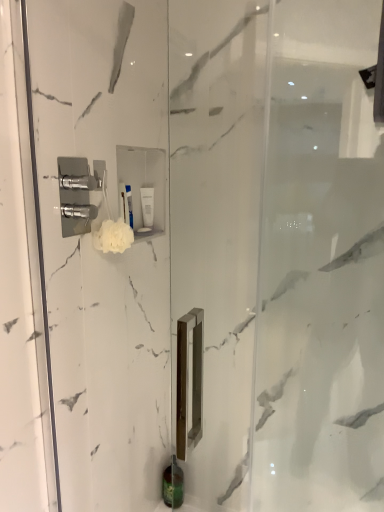
Question: From the image's perspective, does green matte bottle at lower center, the 1th toiletry from the right, appear lower than white fluffy sponge at upper center?

Choices:
 (A) yes
 (B) no

Answer: (A)

Question: Does green matte bottle at lower center, placed as the 1th toiletry when sorted from back to front, have a larger size compared to white fluffy sponge at upper center?

Choices:
 (A) yes
 (B) no

Answer: (A)

Question: From a real-world perspective, is green matte bottle at lower center, placed as the 1th toiletry when sorted from back to front, below white fluffy sponge at upper center?

Choices:
 (A) no
 (B) yes

Answer: (B)

Question: Is there a large distance between green matte bottle at lower center, which appears as the 2th toiletry when viewed from the top, and white fluffy sponge at upper center?

Choices:
 (A) no
 (B) yes

Answer: (B)

Question: Would you say white fluffy sponge at upper center is part of green matte bottle at lower center, the 1th toiletry in the bottom-to-top sequence,'s contents?

Choices:
 (A) yes
 (B) no

Answer: (B)

Question: In the image, is white fluffy sponge at upper center on the left side or the right side of white matte tube at upper center, which is the second toiletry in back-to-front order?

Choices:
 (A) left
 (B) right

Answer: (A)

Question: Which is correct: white fluffy sponge at upper center is inside white matte tube at upper center, placed as the 1th toiletry when sorted from top to bottom, or outside of it?

Choices:
 (A) inside
 (B) outside

Answer: (B)

Question: Is point (124, 248) positioned closer to the camera than point (148, 203)?

Choices:
 (A) farther
 (B) closer

Answer: (B)

Question: From a real-world perspective, is white fluffy sponge at upper center positioned above or below white matte tube at upper center, which is the second toiletry in back-to-front order?

Choices:
 (A) above
 (B) below

Answer: (B)

Question: From a real-world perspective, is white fluffy sponge at upper center positioned above or below green matte bottle at lower center, which is the 2th toiletry in left-to-right order?

Choices:
 (A) above
 (B) below

Answer: (A)

Question: Based on their sizes in the image, would you say white fluffy sponge at upper center is bigger or smaller than green matte bottle at lower center, which is the 2th toiletry in left-to-right order?

Choices:
 (A) small
 (B) big

Answer: (A)

Question: Do you think white fluffy sponge at upper center is within green matte bottle at lower center, which is the 2th toiletry in left-to-right order, or outside of it?

Choices:
 (A) outside
 (B) inside

Answer: (A)

Question: Is white fluffy sponge at upper center wider or thinner than green matte bottle at lower center, placed as the 1th toiletry when sorted from back to front?

Choices:
 (A) thin
 (B) wide

Answer: (A)

Question: Is green matte bottle at lower center, the 1th toiletry in the bottom-to-top sequence, to the left or to the right of white fluffy sponge at upper center in the image?

Choices:
 (A) right
 (B) left

Answer: (A)

Question: Looking at their shapes, would you say green matte bottle at lower center, the 1th toiletry from the right, is wider or thinner than white fluffy sponge at upper center?

Choices:
 (A) thin
 (B) wide

Answer: (B)